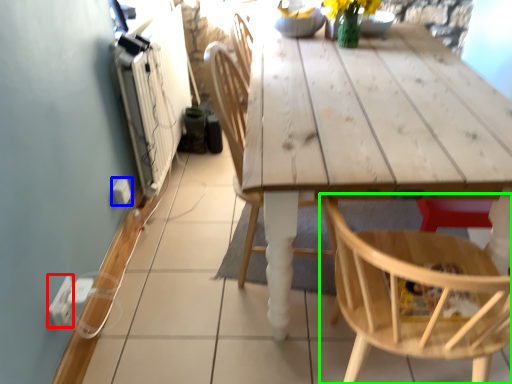
Question: Which object is the closest to the electric outlet (highlighted by a red box)? Choose among these: electric outlet (highlighted by a blue box) or chair (highlighted by a green box).

Choices:
 (A) electric outlet
 (B) chair

Answer: (A)